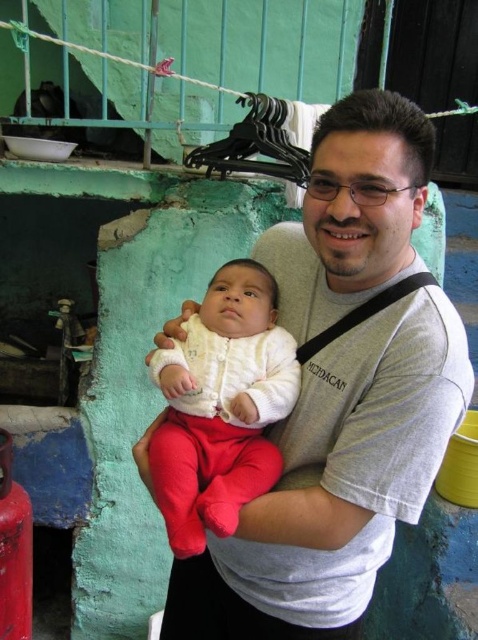
Question: Which point is farther from the camera taking this photo?

Choices:
 (A) (197, 344)
 (B) (392, 269)

Answer: (A)

Question: Which point is farther from the camera taking this photo?

Choices:
 (A) (302, 291)
 (B) (163, 499)

Answer: (A)

Question: Is gray cotton shirt at center positioned at the back of white soft baby at center?

Choices:
 (A) yes
 (B) no

Answer: (B)

Question: In this image, where is gray cotton shirt at center located relative to white soft baby at center?

Choices:
 (A) below
 (B) above

Answer: (A)

Question: In this image, where is gray cotton shirt at center located relative to white soft baby at center?

Choices:
 (A) left
 (B) right

Answer: (B)

Question: Which of the following is the farthest from the observer?

Choices:
 (A) gray cotton shirt at center
 (B) white soft baby at center

Answer: (B)